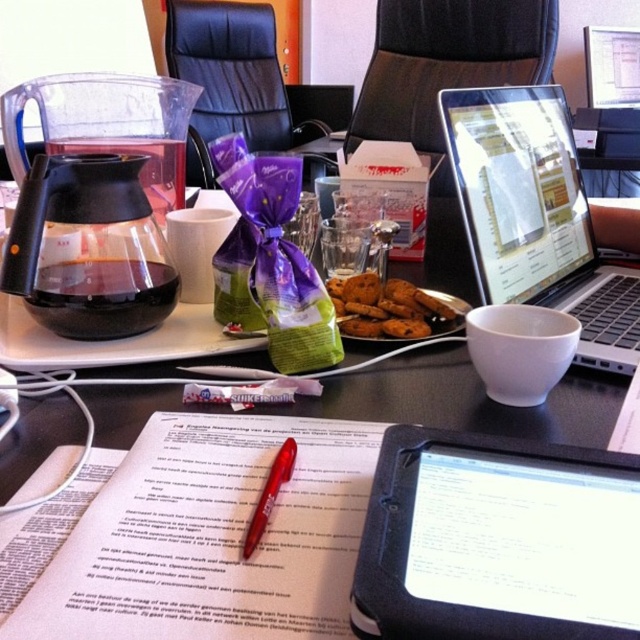
You are organizing your desk and need to place a 4.5 inch wide stapler between the white paper at center and the black plastic tablet at lower center. Can you fit it there without overlapping either item?

The distance between the white paper at center and the black plastic tablet at lower center is 3.72 inches, which is less than the 4.5 inch width of the stapler. Therefore, the stapler cannot fit between them without overlapping one or both items.

Consider the image. You are organizing items on your desk and need to place both the chocolate chip cookies at center and the red plastic pen at center into a drawer. The drawer has a height limit of 10 cm. Can both items fit vertically without exceeding the height limit?

The chocolate chip cookies at center is larger in size than red plastic pen at center. However, the exact height of each item isn not specified in the description. Therefore, it is uncertain if both items will fit vertically within the 10 cm height limit of the drawer.

You are organizing items on your desk and want to place a new item between the white paper at center and the transparent glass carafe at upper left. The item you want to place is 5 inches long. Is there enough space between them to fit this item?

The distance between the white paper at center and the transparent glass carafe at upper left is 10.44 inches. Since the item you want to place is 5 inches long, there is enough space to fit it between them as 5 inches is less than 10.44 inches.